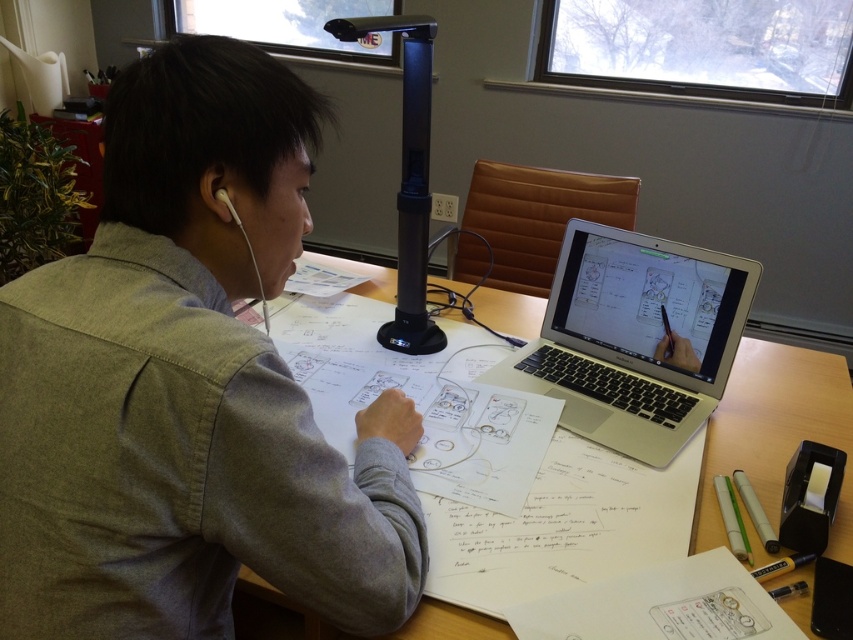
Is gray cotton shirt at center to the right of white matte earphone at upper left from the viewer's perspective?

Yes, gray cotton shirt at center is to the right of white matte earphone at upper left.

Who is more distant from viewer, (283, 385) or (241, 227)?

Positioned behind is point (241, 227).

Who is more forward, (200,474) or (219,198)?

Point (200,474) is more forward.

Where is `gray cotton shirt at center`? The image size is (853, 640). gray cotton shirt at center is located at coordinates (189, 387).

Which is behind, point (149, 480) or point (579, 376)?

The point (579, 376) is more distant.

Is gray cotton shirt at center smaller than silver metallic laptop at center?

Actually, gray cotton shirt at center might be larger than silver metallic laptop at center.

Between point (167, 557) and point (599, 275), which one is positioned behind?

The point (599, 275) is more distant.

Where is `gray cotton shirt at center`? Image resolution: width=853 pixels, height=640 pixels. gray cotton shirt at center is located at coordinates (189, 387).

Does gray cotton shirt at center have a greater width compared to black plastic table lamp at center?

Yes, gray cotton shirt at center is wider than black plastic table lamp at center.

Is gray cotton shirt at center smaller than black plastic table lamp at center?

No, gray cotton shirt at center is not smaller than black plastic table lamp at center.

Is point (26, 572) less distant than point (398, 337)?

Yes, point (26, 572) is closer to viewer.

You are a GUI agent. You are given a task and a screenshot of the screen. Output one action in this format:
    pyautogui.click(x=<x>, y=<y>)
    Task: Click on the gray cotton shirt at center
    
    Given the screenshot: What is the action you would take?
    pyautogui.click(x=189, y=387)